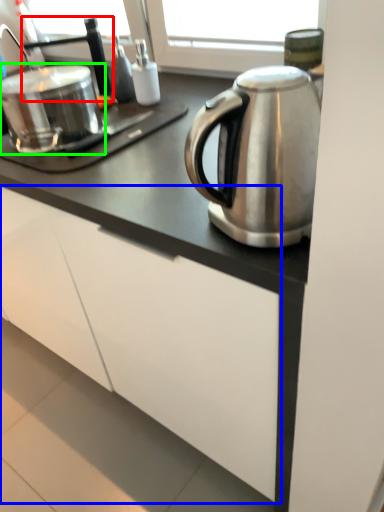
Question: Which object is positioned farthest from faucet (highlighted by a red box)? Select from cabinetry (highlighted by a blue box) and appliance (highlighted by a green box).

Choices:
 (A) cabinetry
 (B) appliance

Answer: (A)